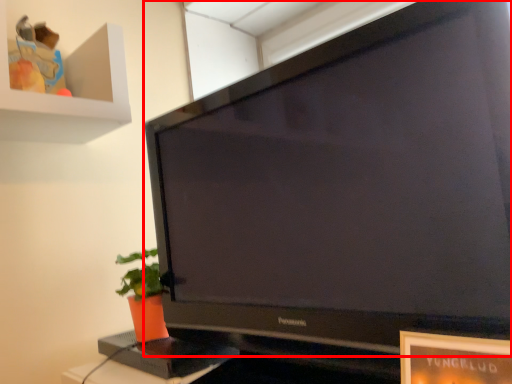
Question: In this image, where is television (annotated by the red box) located relative to houseplant?

Choices:
 (A) right
 (B) left

Answer: (A)